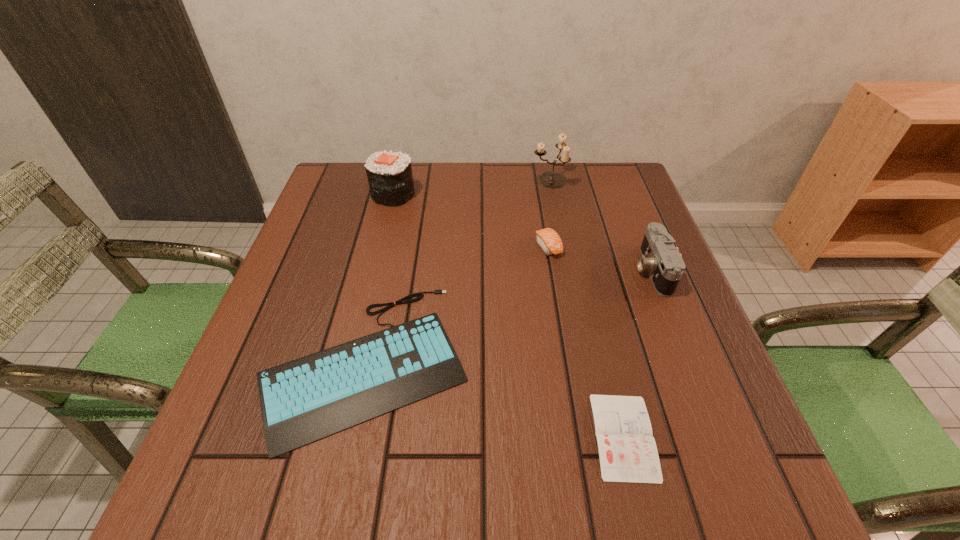
This screenshot has height=540, width=960. I want to click on candle holder, so click(551, 180).

Locate an element on the screen. The height and width of the screenshot is (540, 960). the second tallest object is located at coordinates (389, 174).

This screenshot has height=540, width=960. In order to click on the taller sushi in this screenshot , I will do `click(389, 174)`.

Identify the location of the rightmost object. coord(661,258).

Where is `the fourth shortest object`? the fourth shortest object is located at coordinates (661, 258).

I want to click on the fourth tallest object, so click(549, 241).

The height and width of the screenshot is (540, 960). I want to click on the nearer sushi, so click(549, 241).

Find the location of `computer keyboard`. computer keyboard is located at coordinates (304, 400).

Find the location of a particular element. The width and height of the screenshot is (960, 540). the shortest object is located at coordinates (628, 453).

The image size is (960, 540). Identify the location of free space located on the right of the candle holder. (630, 180).